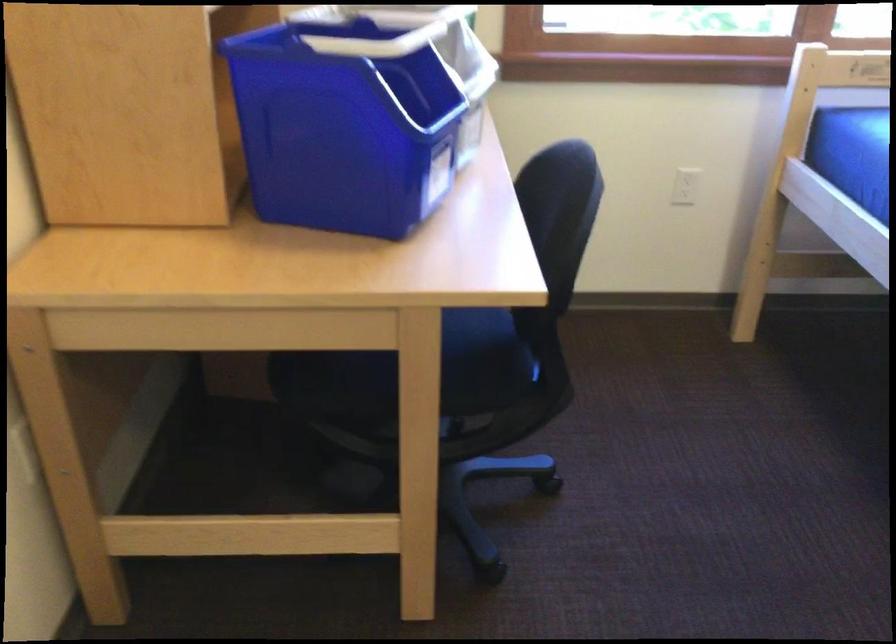
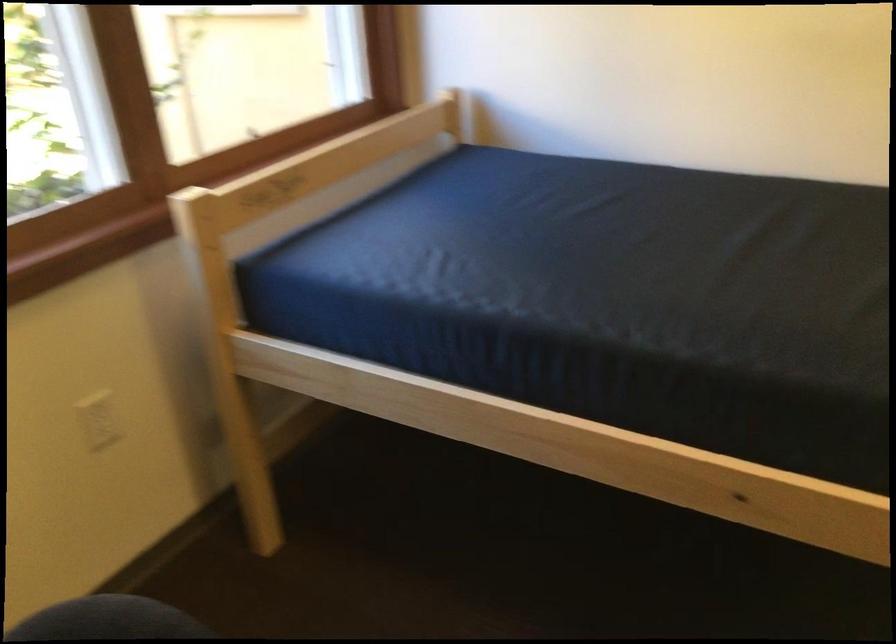
Question: Based on the continuous images, in which direction is the camera rotating? Reply with the corresponding letter.

Choices:
 (A) Left
 (B) Right
 (C) Up
 (D) Down

Answer: (B)